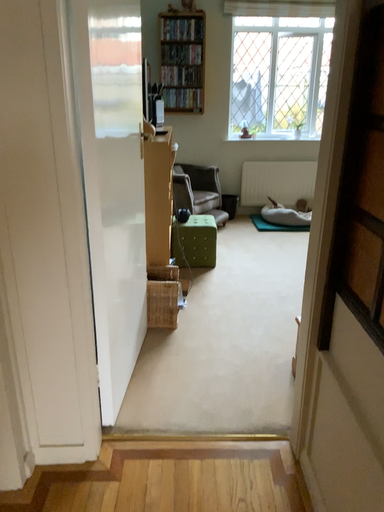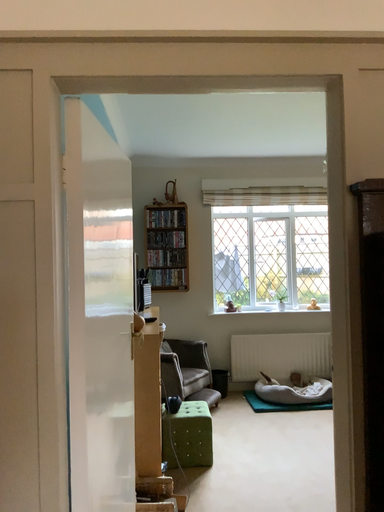
Question: How did the camera likely rotate when shooting the video?

Choices:
 (A) rotated upward
 (B) rotated downward

Answer: (A)